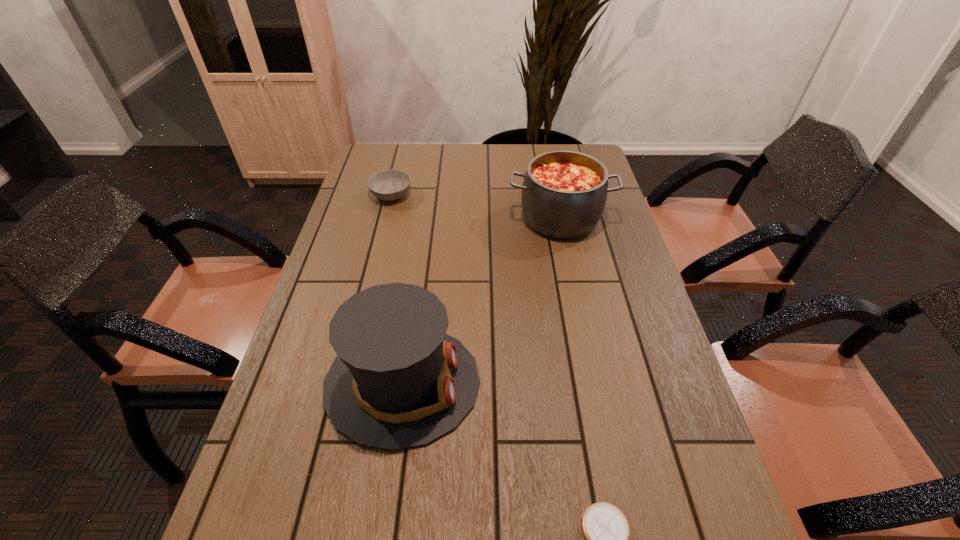
Image resolution: width=960 pixels, height=540 pixels. I want to click on vacant region at the far edge of the desktop, so click(x=444, y=153).

Where is `vacant space at the left edge of the desktop`? Image resolution: width=960 pixels, height=540 pixels. vacant space at the left edge of the desktop is located at coordinates (386, 235).

You are a GUI agent. You are given a task and a screenshot of the screen. Output one action in this format:
    pyautogui.click(x=<x>, y=<y>)
    Task: Click on the vacant point at the right edge
    The height and width of the screenshot is (540, 960).
    Given the screenshot: What is the action you would take?
    pyautogui.click(x=619, y=414)

At what (x,y) coordinates should I click in order to perform the action: click on free area in between the casserole and the dress hat. Please return your answer as a coordinate pair (x, y). The width and height of the screenshot is (960, 540). Looking at the image, I should click on (481, 300).

Locate an element on the screen. The image size is (960, 540). free space between the dress hat and the second tallest object is located at coordinates (481, 300).

Locate an element on the screen. Image resolution: width=960 pixels, height=540 pixels. empty space between the casserole and the bowl is located at coordinates (475, 206).

The image size is (960, 540). Find the location of `the closest object to the second tallest object`. the closest object to the second tallest object is located at coordinates (388, 185).

Identify which object is located as the second nearest to the third farthest object. Please provide its 2D coordinates. Your answer should be formatted as a tuple, i.e. [(x, y)], where the tuple contains the x and y coordinates of a point satisfying the conditions above.

[(564, 192)]

This screenshot has width=960, height=540. I want to click on vacant space that satisfies the following two spatial constraints: 1. on the front side of the bowl; 2. on the right side of the second tallest object, so click(x=386, y=218).

This screenshot has height=540, width=960. I want to click on vacant area in the image that satisfies the following two spatial constraints: 1. on the front side of the third shortest object; 2. with goggles on the front of the second nearest object, so click(x=594, y=383).